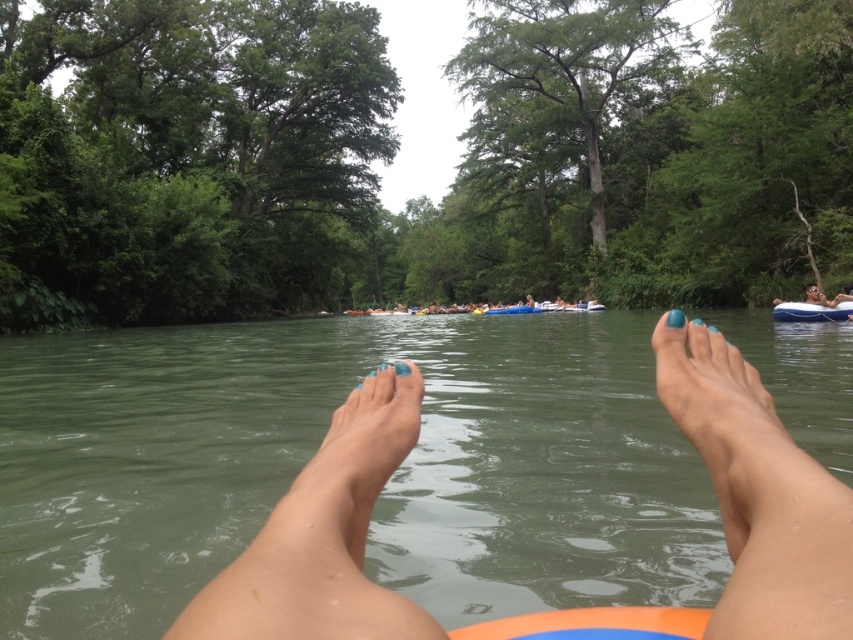
Is the position of blue painted nails at center less distant than that of teal matte foot at center?

Yes, blue painted nails at center is closer to the viewer.

Can you confirm if blue painted nails at center is bigger than teal matte foot at center?

Correct, blue painted nails at center is larger in size than teal matte foot at center.

Find the location of a particular element. blue painted nails at center is located at coordinates (758, 492).

I want to click on blue painted nails at center, so click(758, 492).

Which is below, teal matte foot at center or blue inflatable raft at right?

teal matte foot at center is lower down.

Is point (750, 428) closer to camera compared to point (792, 304)?

Yes, it is.

Is point (735, 444) closer to camera compared to point (801, 310)?

Yes, point (735, 444) is in front of point (801, 310).

Where is `teal matte foot at center`? This screenshot has width=853, height=640. teal matte foot at center is located at coordinates (737, 442).

Who is positioned more to the right, blue matte foot at center or blue inflatable raft at right?

From the viewer's perspective, blue inflatable raft at right appears more on the right side.

Who is taller, blue matte foot at center or blue inflatable raft at right?

blue inflatable raft at right

Locate an element on the screen. This screenshot has width=853, height=640. blue matte foot at center is located at coordinates (346, 476).

Identify the location of blue matte foot at center. (346, 476).